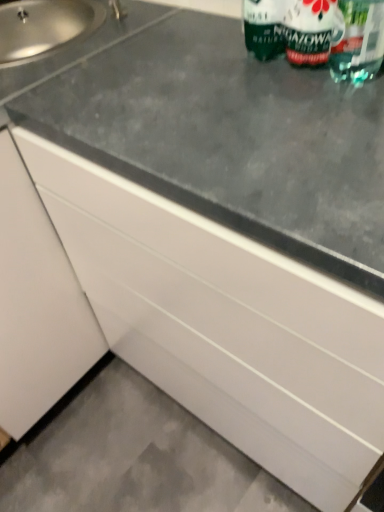
Where is `free spot to the left of green matte bottle at upper right`? This screenshot has height=512, width=384. free spot to the left of green matte bottle at upper right is located at coordinates (205, 65).